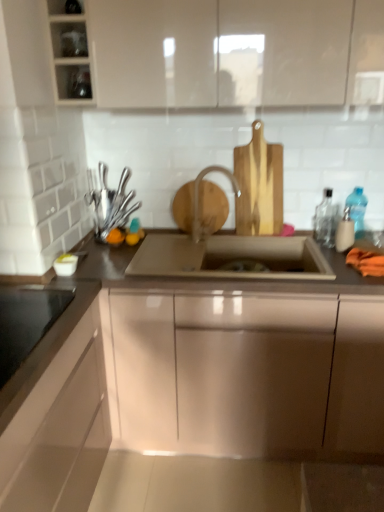
What are the coordinates of `space that is in front of satin silver cutlery at left, which appears as the 2th appliance when ordered from the bottom` in the screenshot? It's located at (111, 245).